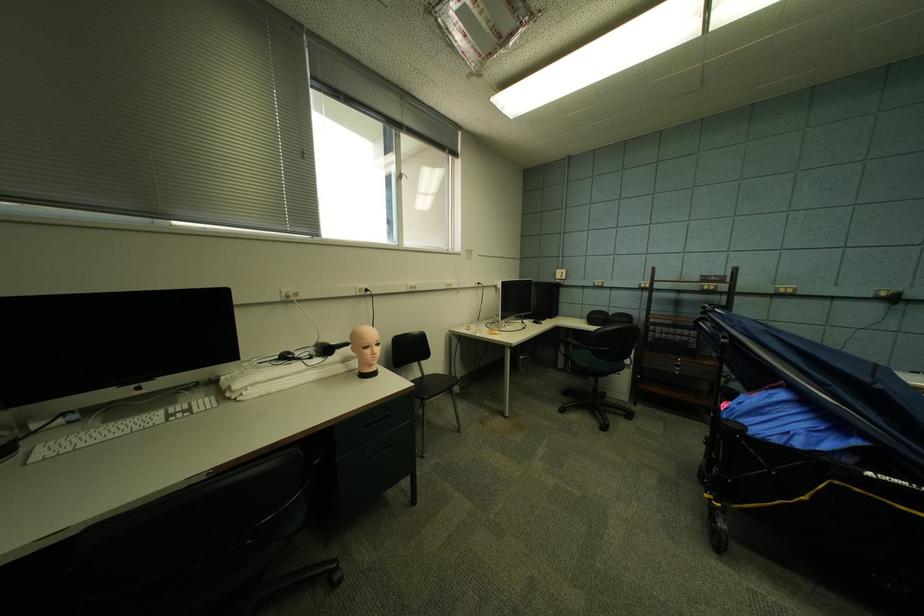
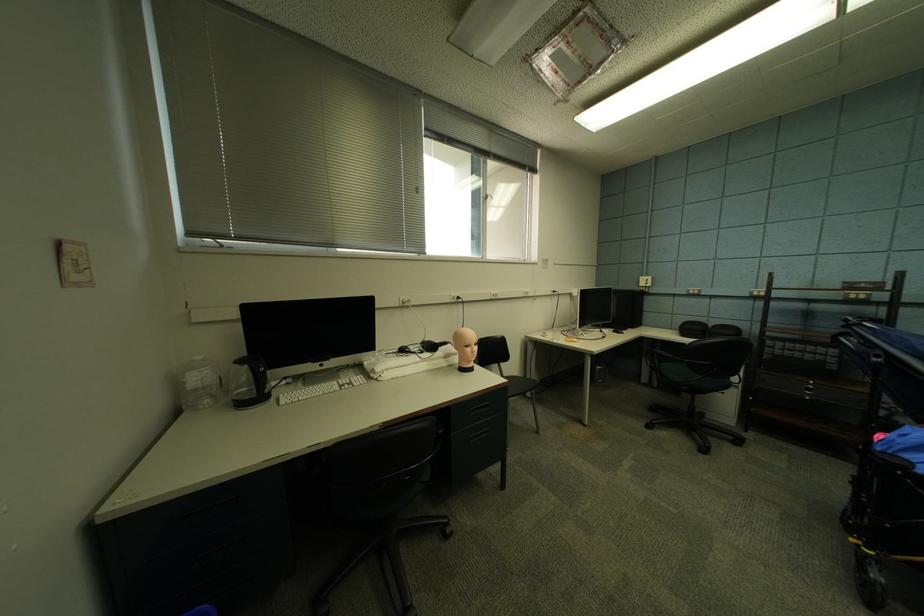
Where in the second image is the point corresponding to point (565, 274) from the first image?

(650, 282)